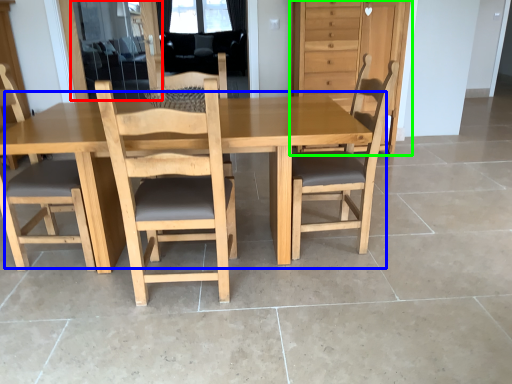
Question: Estimate the real-world distances between objects in this image. Which object is farther from screen door (highlighted by a red box), table (highlighted by a blue box) or dresser (highlighted by a green box)?

Choices:
 (A) table
 (B) dresser

Answer: (A)